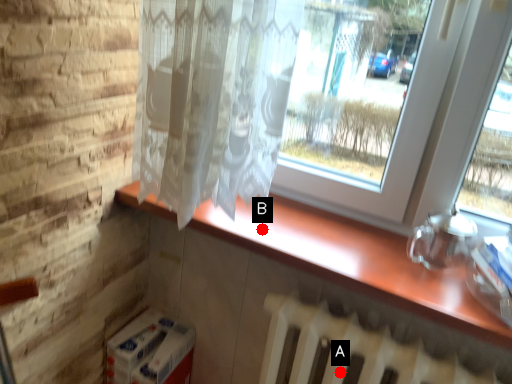
Question: Two points are circled on the image, labeled by A and B beside each circle. Which point is farther to the camera?

Choices:
 (A) A is further
 (B) B is further

Answer: (B)